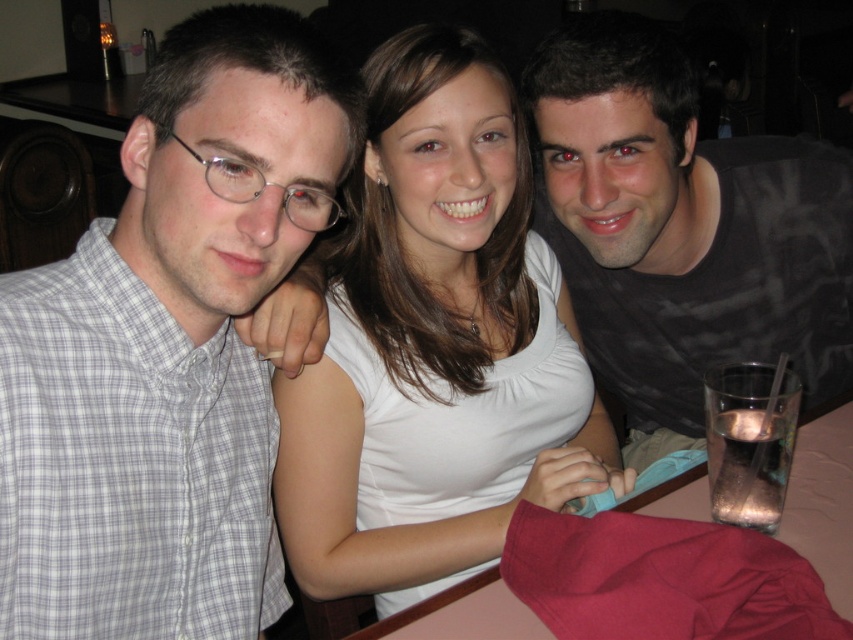
Question: Which point is farther to the camera?

Choices:
 (A) (676, 186)
 (B) (839, 512)
 (C) (12, 300)
 (D) (479, 156)

Answer: (A)

Question: Does matte black shirt at upper right appear on the left side of smooth plastic table at lower right?

Choices:
 (A) no
 (B) yes

Answer: (A)

Question: Which point appears closest to the camera in this image?

Choices:
 (A) (386, 326)
 (B) (548, 237)
 (C) (311, 237)
 (D) (506, 588)

Answer: (C)

Question: Which point is closer to the camera?

Choices:
 (A) smooth plastic table at lower right
 (B) gray checkered shirt at left
 (C) matte black shirt at upper right
 (D) white smooth shirt at center

Answer: (B)

Question: Does white smooth shirt at center have a larger size compared to smooth plastic table at lower right?

Choices:
 (A) no
 (B) yes

Answer: (B)

Question: Where is gray checkered shirt at left located in relation to white smooth shirt at center in the image?

Choices:
 (A) above
 (B) below

Answer: (B)